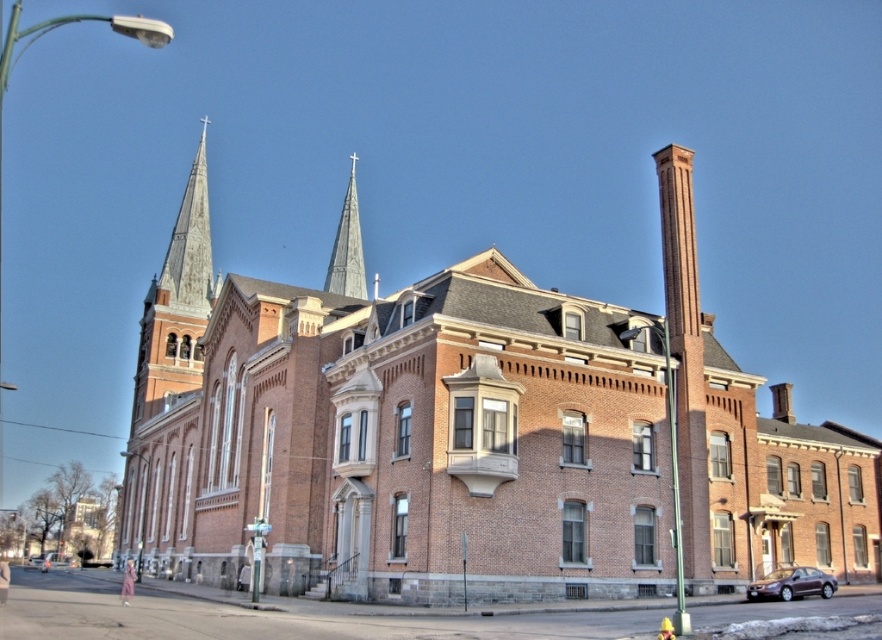
Is smooth gray steeple at center taller than metallic silver car at lower left?

Indeed, smooth gray steeple at center has a greater height compared to metallic silver car at lower left.

Does smooth gray steeple at center appear on the left side of metallic silver car at lower left?

No, smooth gray steeple at center is not to the left of metallic silver car at lower left.

Describe the element at coordinates (348, 248) in the screenshot. This screenshot has height=640, width=882. I see `smooth gray steeple at center` at that location.

At what (x,y) coordinates should I click in order to perform the action: click on smooth gray steeple at center. Please return your answer as a coordinate pair (x, y). Image resolution: width=882 pixels, height=640 pixels. Looking at the image, I should click on (348, 248).

Based on the photo, who is more forward, (851, 547) or (70, 556)?

Point (851, 547) is more forward.

Is brick church at center bigger than metallic silver car at lower left?

Yes, brick church at center is bigger than metallic silver car at lower left.

Is point (604, 490) behind point (49, 566)?

That is False.

Where is `brick church at center`? The image size is (882, 640). brick church at center is located at coordinates (469, 436).

Does brick church at center appear on the right side of rusty metal spire at upper left?

Yes, brick church at center is to the right of rusty metal spire at upper left.

Does brick church at center have a smaller size compared to rusty metal spire at upper left?

Actually, brick church at center might be larger than rusty metal spire at upper left.

Who is more forward, [675,332] or [150,346]?

Positioned in front is point [675,332].

You are a GUI agent. You are given a task and a screenshot of the screen. Output one action in this format:
    pyautogui.click(x=<x>, y=<y>)
    Task: Click on the brick church at center
    This screenshot has height=640, width=882.
    Given the screenshot: What is the action you would take?
    pyautogui.click(x=469, y=436)